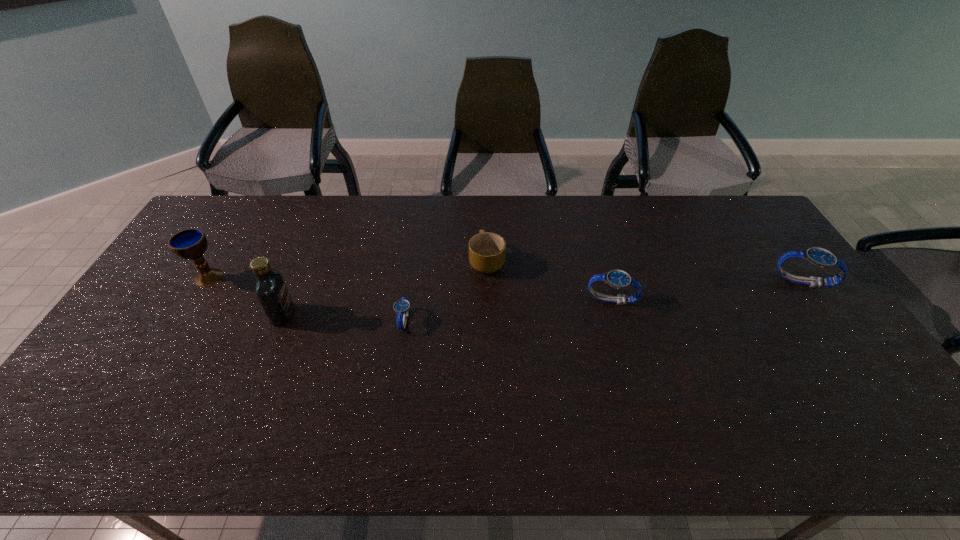
In the image, there is a desktop. Identify the location of vacant space at the far edge. The image size is (960, 540). pyautogui.click(x=355, y=231).

The height and width of the screenshot is (540, 960). I want to click on free space at the near edge, so [x=719, y=387].

Locate an element on the screen. Image resolution: width=960 pixels, height=540 pixels. vacant space at the left edge of the desktop is located at coordinates (130, 360).

In the image, there is a desktop. At what (x,y) coordinates should I click in order to perform the action: click on free space at the far right corner. Please return your answer as a coordinate pair (x, y). Image resolution: width=960 pixels, height=540 pixels. Looking at the image, I should click on (708, 211).

Where is `free region at the near right corner`? The width and height of the screenshot is (960, 540). free region at the near right corner is located at coordinates (865, 390).

The width and height of the screenshot is (960, 540). I want to click on blank region between the rightmost watch and the leftmost object, so click(x=506, y=279).

Identify the location of free space between the second object from left to right and the third object from right to left. (385, 288).

In order to click on free space between the third object from right to left and the fourth object from right to left in this screenshot , I will do `click(445, 291)`.

At what (x,y) coordinates should I click in order to perform the action: click on vacant point located between the vodka and the rightmost object. Please return your answer as a coordinate pair (x, y). The height and width of the screenshot is (540, 960). Looking at the image, I should click on (542, 298).

Locate an element on the screen. vacant space that's between the second tallest watch and the fifth object from right to left is located at coordinates (447, 307).